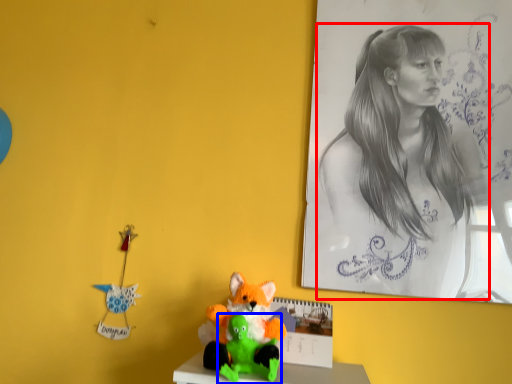
Question: Which point is further to the camera, woman (highlighted by a red box) or toy (highlighted by a blue box)?

Choices:
 (A) woman
 (B) toy

Answer: (A)